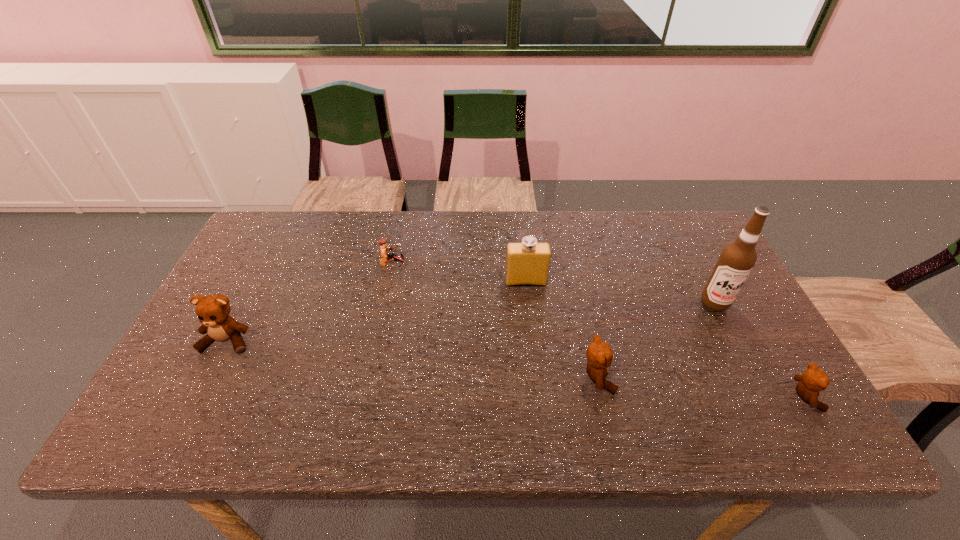
Find the location of a particular element. The width and height of the screenshot is (960, 540). alcohol at the right edge is located at coordinates (737, 259).

Identify the location of object located at the near right corner. (813, 380).

At what (x,y) coordinates should I click in order to perform the action: click on blank space at the far edge of the desktop. Please return your answer as a coordinate pair (x, y). Image resolution: width=960 pixels, height=540 pixels. Looking at the image, I should click on (390, 239).

Where is `free space at the near edge`? Image resolution: width=960 pixels, height=540 pixels. free space at the near edge is located at coordinates [x=417, y=401].

Where is `vacant space at the left edge of the desktop`? vacant space at the left edge of the desktop is located at coordinates (242, 293).

Where is `vacant space at the right edge of the desktop`? Image resolution: width=960 pixels, height=540 pixels. vacant space at the right edge of the desktop is located at coordinates (703, 331).

In the image, there is a desktop. Identify the location of free region at the far left corner. (262, 245).

Locate an element on the screen. The image size is (960, 540). vacant space at the far right corner of the desktop is located at coordinates (685, 249).

What are the coordinates of `free location at the near right corner of the desktop` in the screenshot? It's located at (732, 395).

Where is `unoccupied area between the fifth object from right to left and the fourth object from right to left`? unoccupied area between the fifth object from right to left and the fourth object from right to left is located at coordinates pos(460,273).